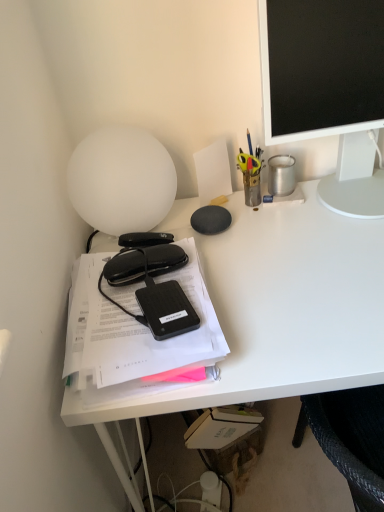
Where is `vacant space situated above black matte hardcover at left (from a real-world perspective)`? This screenshot has height=512, width=384. vacant space situated above black matte hardcover at left (from a real-world perspective) is located at coordinates (139, 285).